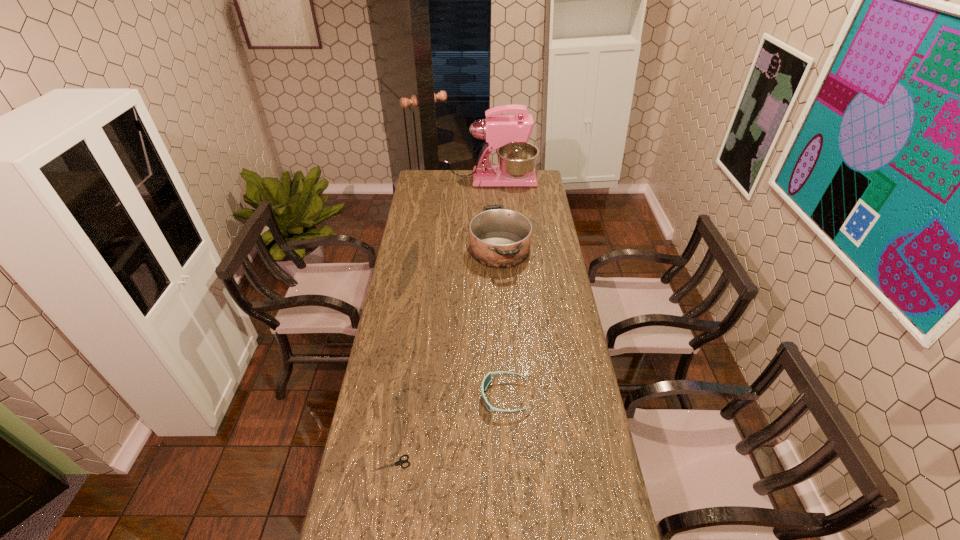
In the image, there is a desktop. At what (x,y) coordinates should I click in order to perform the action: click on vacant region at the left edge. Please return your answer as a coordinate pair (x, y). Image resolution: width=960 pixels, height=540 pixels. Looking at the image, I should click on (395, 334).

The height and width of the screenshot is (540, 960). In the image, there is a desktop. Identify the location of vacant area at the right edge. (547, 204).

You are a GUI agent. You are given a task and a screenshot of the screen. Output one action in this format:
    pyautogui.click(x=<x>, y=<y>)
    Task: Click on the unoccupied area between the third tallest object and the shortest object
    The height and width of the screenshot is (540, 960).
    Given the screenshot: What is the action you would take?
    (x=448, y=430)

Find the location of a particular element. free spot between the goggles and the farthest object is located at coordinates (498, 288).

Where is `empty space that is in between the third tallest object and the leftmost object`? The height and width of the screenshot is (540, 960). empty space that is in between the third tallest object and the leftmost object is located at coordinates (448, 430).

You are a GUI agent. You are given a task and a screenshot of the screen. Output one action in this format:
    pyautogui.click(x=<x>, y=<y>)
    Task: Click on the unoccupied area between the mixer and the second shortest object
    The width and height of the screenshot is (960, 540).
    Given the screenshot: What is the action you would take?
    pyautogui.click(x=498, y=288)

Identify the location of empty space that is in between the saucepan and the third farthest object. The image size is (960, 540). (502, 323).

You are a GUI agent. You are given a task and a screenshot of the screen. Output one action in this format:
    pyautogui.click(x=<x>, y=<y>)
    Task: Click on the vacant space that's between the tallest object and the shortest object
    The width and height of the screenshot is (960, 540).
    Given the screenshot: What is the action you would take?
    pyautogui.click(x=441, y=321)

At what (x,y) coordinates should I click in order to perform the action: click on object that is the second closest to the farthest object. Please return your answer as a coordinate pair (x, y). Looking at the image, I should click on (487, 379).

Locate an element on the screen. This screenshot has width=960, height=540. object that stands as the second closest to the third shortest object is located at coordinates (487, 379).